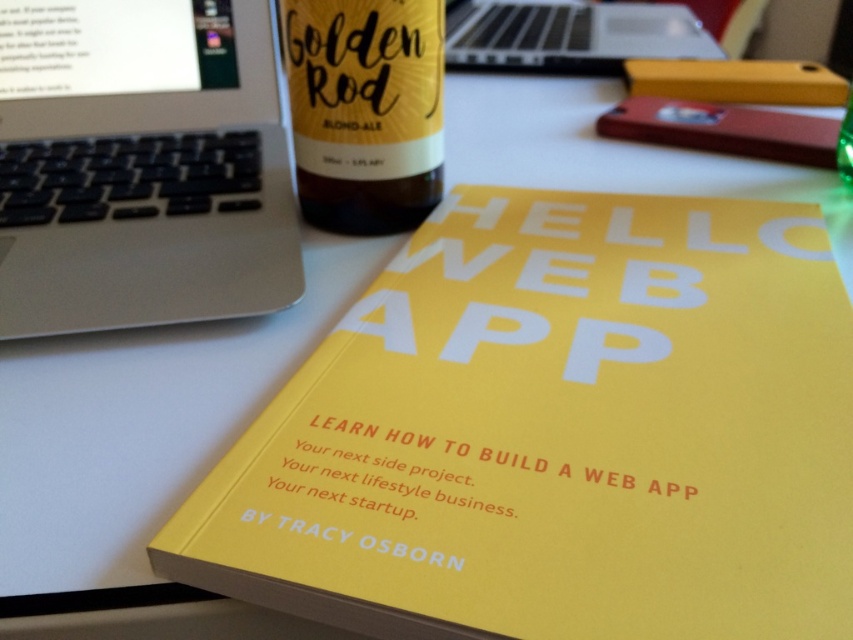
Based on the photo, does silver/black plastic laptop at upper left have a greater height compared to matte glass bottle at upper center?

Yes, silver/black plastic laptop at upper left is taller than matte glass bottle at upper center.

Who is positioned more to the left, silver/black plastic laptop at upper left or matte glass bottle at upper center?

Positioned to the left is silver/black plastic laptop at upper left.

Which is in front, point (257, 310) or point (849, 52)?

Point (257, 310) is more forward.

In order to click on silver/black plastic laptop at upper left in this screenshot , I will do `click(140, 164)`.

Can you confirm if yellow matte glass bottle at center is smaller than matte glass bottle at upper center?

Yes, yellow matte glass bottle at center is smaller than matte glass bottle at upper center.

Can you confirm if yellow matte glass bottle at center is shorter than matte glass bottle at upper center?

No, yellow matte glass bottle at center is not shorter than matte glass bottle at upper center.

The width and height of the screenshot is (853, 640). I want to click on yellow matte glass bottle at center, so click(x=364, y=109).

Does yellow matte paper at center have a greater width compared to silver/black keyboard at upper center?

No.

Is point (490, 333) positioned after point (602, 24)?

That is False.

Between point (338, 476) and point (490, 33), which one is positioned behind?

The point (490, 33) is behind.

Where is `yellow matte paper at center`? The image size is (853, 640). yellow matte paper at center is located at coordinates (556, 435).